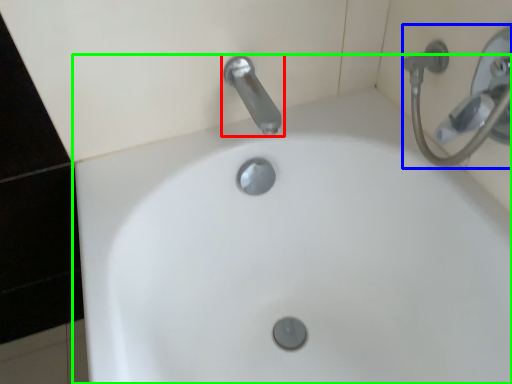
Question: Which object is positioned closest to tap (highlighted by a red box)? Select from shower (highlighted by a blue box) and sink (highlighted by a green box).

Choices:
 (A) shower
 (B) sink

Answer: (A)